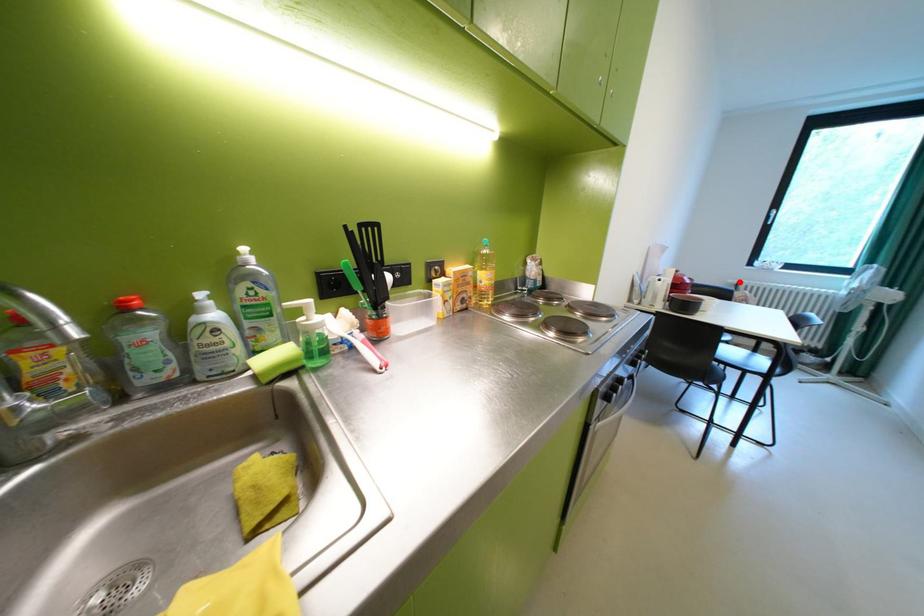
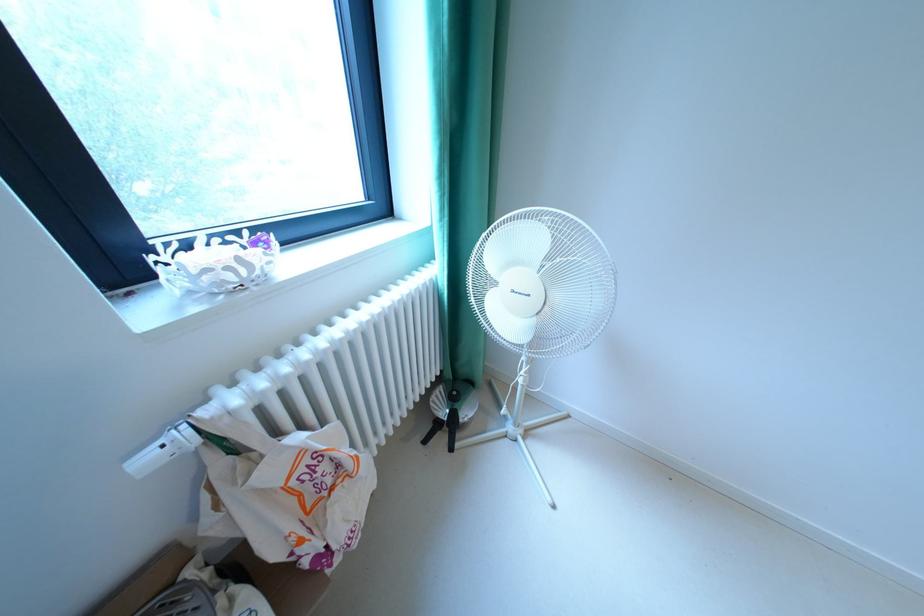
Find the pixel in the second image that matches the highlighted location in the first image.

(156, 460)